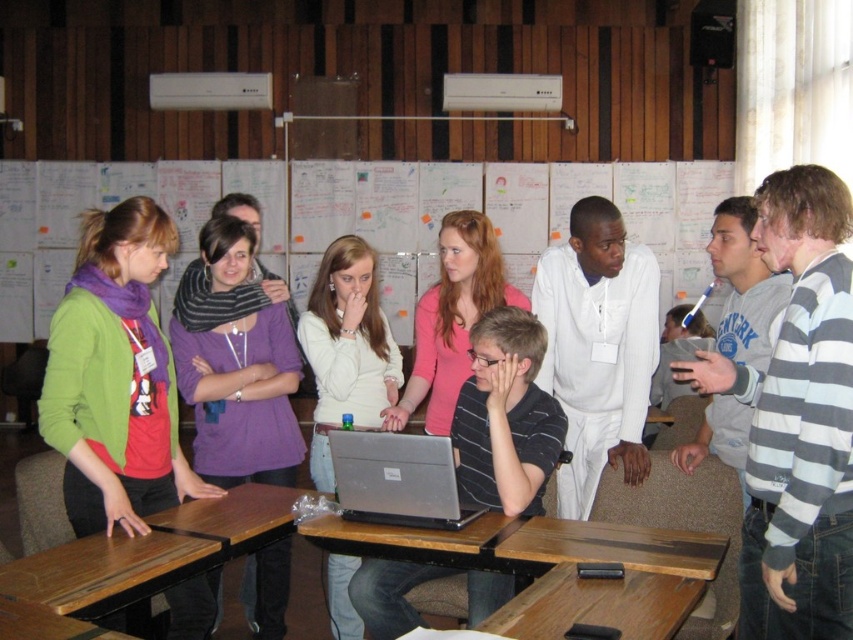
Who is positioned more to the right, white paperboard at center or wooden table at center?

wooden table at center is more to the right.

Locate an element on the screen. white paperboard at center is located at coordinates (508, 212).

At what (x,y) coordinates should I click in order to perform the action: click on white paperboard at center. Please return your answer as a coordinate pair (x, y). Image resolution: width=853 pixels, height=640 pixels. Looking at the image, I should click on (508, 212).

Between silver metallic laptop at center and wooden table at center, which one appears on the left side from the viewer's perspective?

From the viewer's perspective, silver metallic laptop at center appears more on the left side.

The image size is (853, 640). I want to click on silver metallic laptop at center, so click(397, 480).

Is purple soft scarf at center shorter than wooden table at center?

No.

Who is lower down, purple soft scarf at center or wooden table at center?

Positioned lower is wooden table at center.

Does point (201, 250) come in front of point (669, 627)?

No, it is behind (669, 627).

Identify the location of purple soft scarf at center. point(242,396).